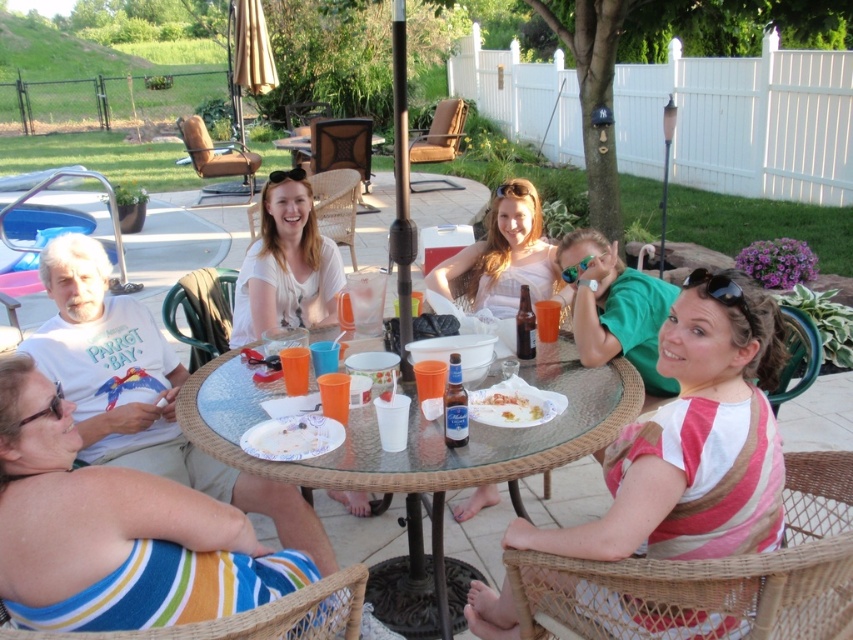
You are a guest at this gathering and want to place your phone on the transparent glass table at center. However, you are wearing the matte white dress at center. Will the dress interfere with placing the phone on the table?

The transparent glass table at center is shorter than the matte white dress at center, so the dress might interfere with placing the phone on the table because the dress could be in the way.

You are standing at the edge of the patio and want to take a photo of the two points mentioned. Which point, point (432,605) or point (498,228), will appear larger in your photo?

Point (432,605) will appear larger in the photo because it is closer to the camera than point (498,228).